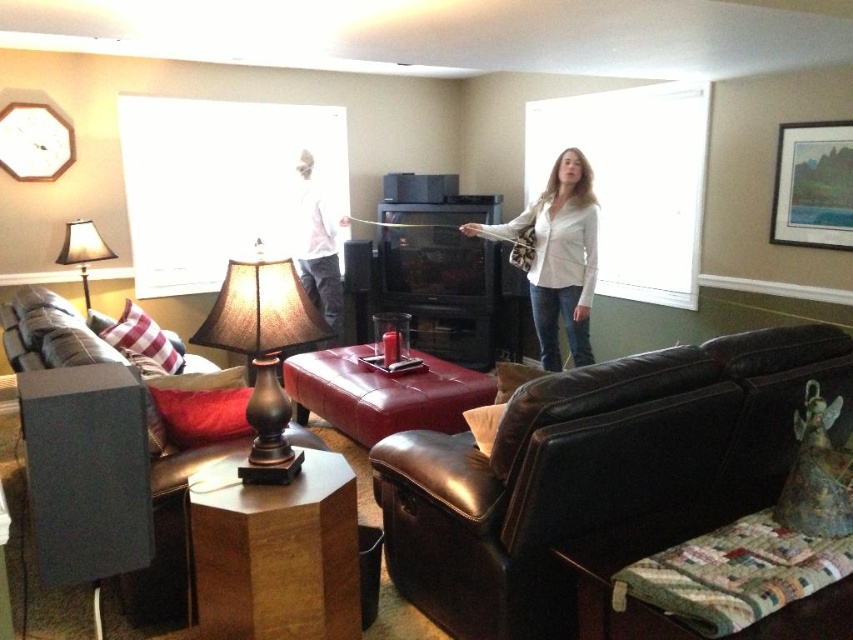
Question: Which object is positioned farthest from the leather armchair at center?

Choices:
 (A) matte brown lamp at left
 (B) white matte shirt at center
 (C) matte brown lamp at center
 (D) white cotton shirt at center

Answer: (A)

Question: Is leather armchair at center wider than leather couch at lower left?

Choices:
 (A) yes
 (B) no

Answer: (B)

Question: Which point appears closest to the camera in this image?

Choices:
 (A) (265, 396)
 (B) (811, 324)
 (C) (28, 586)
 (D) (318, 294)

Answer: (A)

Question: Is leather couch at lower left above matte brown lamp at left?

Choices:
 (A) yes
 (B) no

Answer: (B)

Question: Considering the real-world distances, which object is farthest from the leather couch at lower left?

Choices:
 (A) white cotton shirt at center
 (B) matte brown lamp at left
 (C) matte brown lamp at center

Answer: (A)

Question: Can you confirm if matte brown lamp at center is thinner than leather ottoman at center?

Choices:
 (A) yes
 (B) no

Answer: (A)